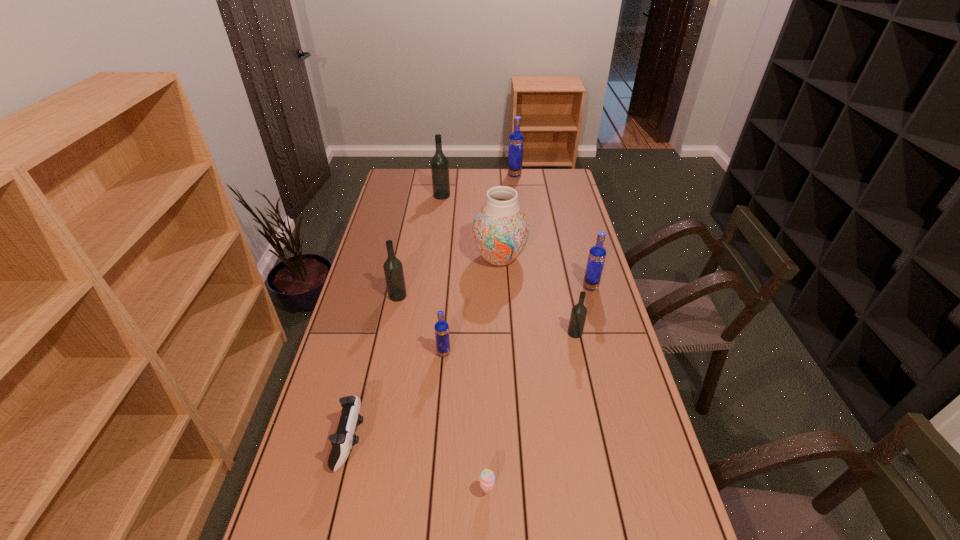
Locate an element on the screen. The width and height of the screenshot is (960, 540). the nearest blue vodka is located at coordinates (441, 327).

I want to click on the second nearest vodka, so click(x=579, y=312).

Locate an element on the screen. Image resolution: width=960 pixels, height=540 pixels. the second object from right to left is located at coordinates pyautogui.click(x=579, y=312).

Locate an element on the screen. The image size is (960, 540). the eighth farthest object is located at coordinates (344, 439).

Find the location of a particular element. the nearest object is located at coordinates (487, 478).

Where is `the shortest object`? the shortest object is located at coordinates (487, 478).

Where is `free space located on the left of the farthest blue vodka`? The width and height of the screenshot is (960, 540). free space located on the left of the farthest blue vodka is located at coordinates (463, 175).

Where is `vacant space located 0.180m on the back of the seventh object from right to left`? The image size is (960, 540). vacant space located 0.180m on the back of the seventh object from right to left is located at coordinates (444, 173).

Locate an element on the screen. The width and height of the screenshot is (960, 540). vacant space situated on the front of the seventh nearest object is located at coordinates (502, 305).

At what (x,y) coordinates should I click in order to perform the action: click on vacant space located on the front of the rightmost blue vodka. Please return your answer as a coordinate pair (x, y). The width and height of the screenshot is (960, 540). Looking at the image, I should click on (600, 320).